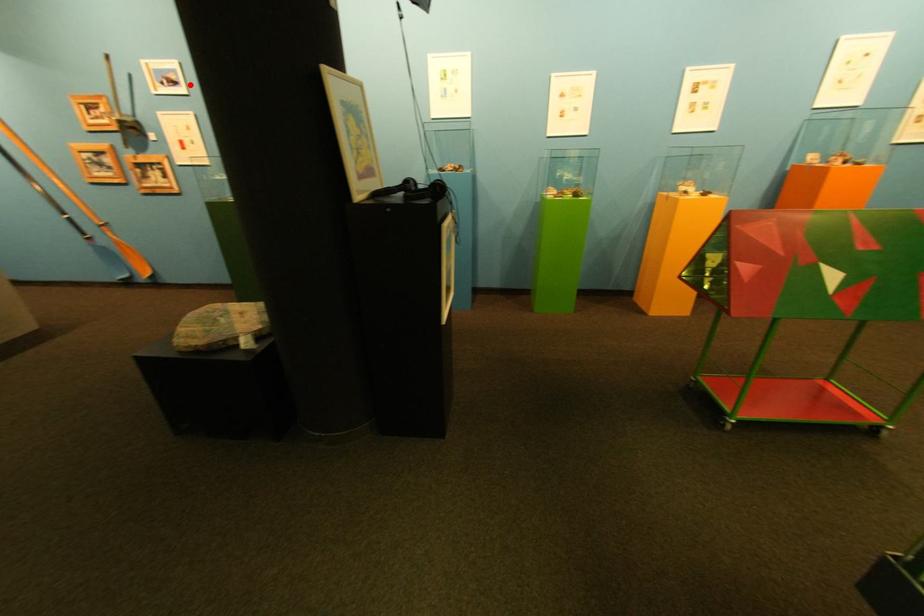
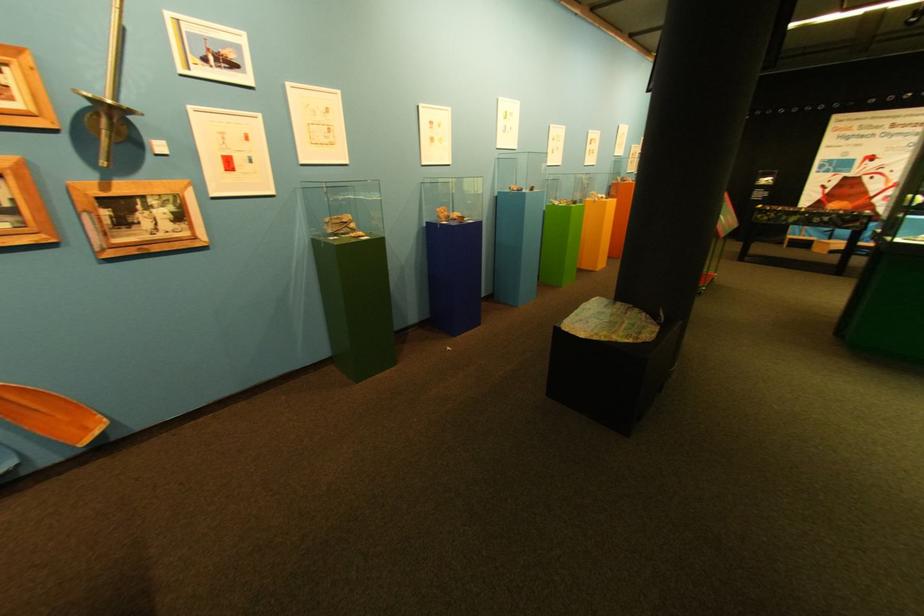
Locate, in the second image, the point that corresponds to the highlighted location in the first image.

(248, 67)